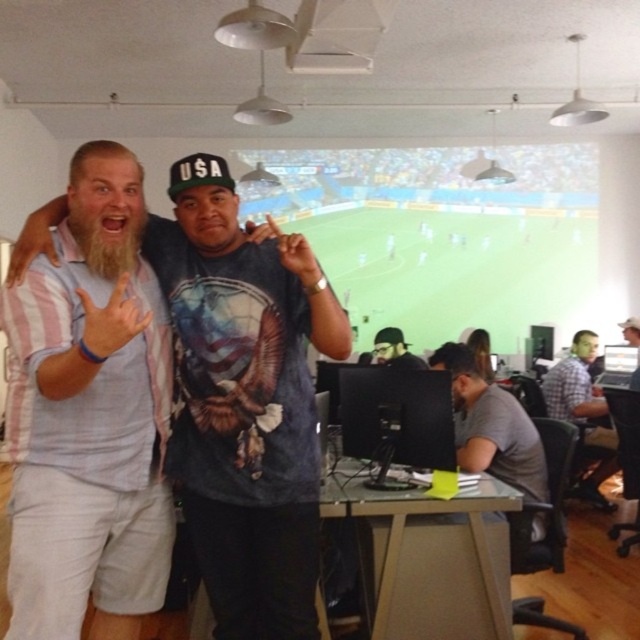
Can you confirm if light blue striped shirt at center is positioned to the left of dark gray knit cap at center?

Correct, you'll find light blue striped shirt at center to the left of dark gray knit cap at center.

Who is more forward, [132,413] or [396,336]?

Point [132,413] is more forward.

This screenshot has width=640, height=640. Find the location of `light blue striped shirt at center`. light blue striped shirt at center is located at coordinates click(88, 417).

Can you confirm if white striped shirt at left is positioned to the right of plaid shirt at right?

In fact, white striped shirt at left is to the left of plaid shirt at right.

Between point (224, 470) and point (582, 378), which one is positioned behind?

The point (582, 378) is behind.

The width and height of the screenshot is (640, 640). I want to click on white striped shirt at left, so click(x=205, y=204).

Identify the location of white striped shirt at left. (205, 204).

Who is more distant from viewer, (461, 396) or (385, 339)?

Positioned behind is point (385, 339).

Is gray matte shirt at center to the left of dark gray knit cap at center from the viewer's perspective?

No, gray matte shirt at center is not to the left of dark gray knit cap at center.

Is point (516, 412) more distant than point (408, 353)?

No.

At what (x,y) coordinates should I click in order to perform the action: click on gray matte shirt at center. Please return your answer as a coordinate pair (x, y). Looking at the image, I should click on (492, 426).